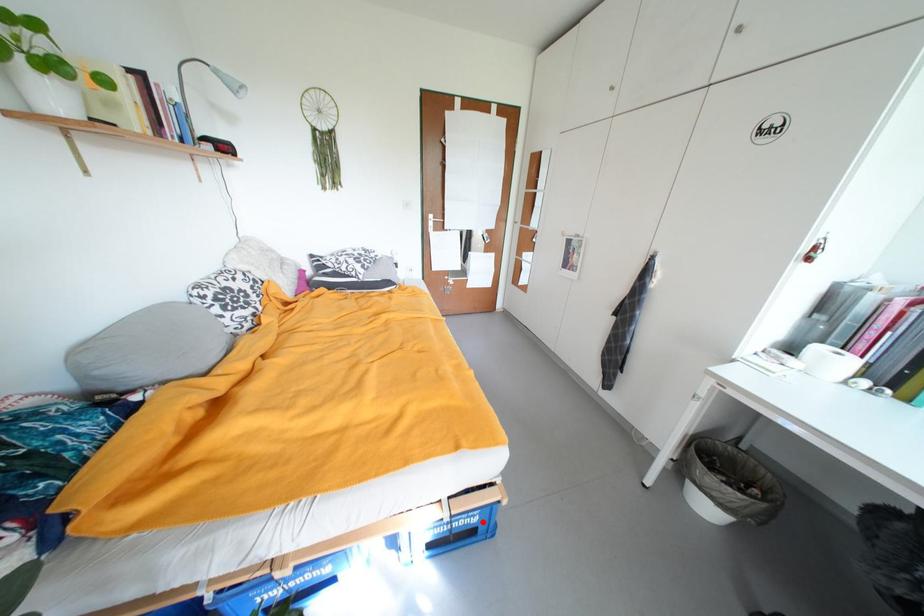
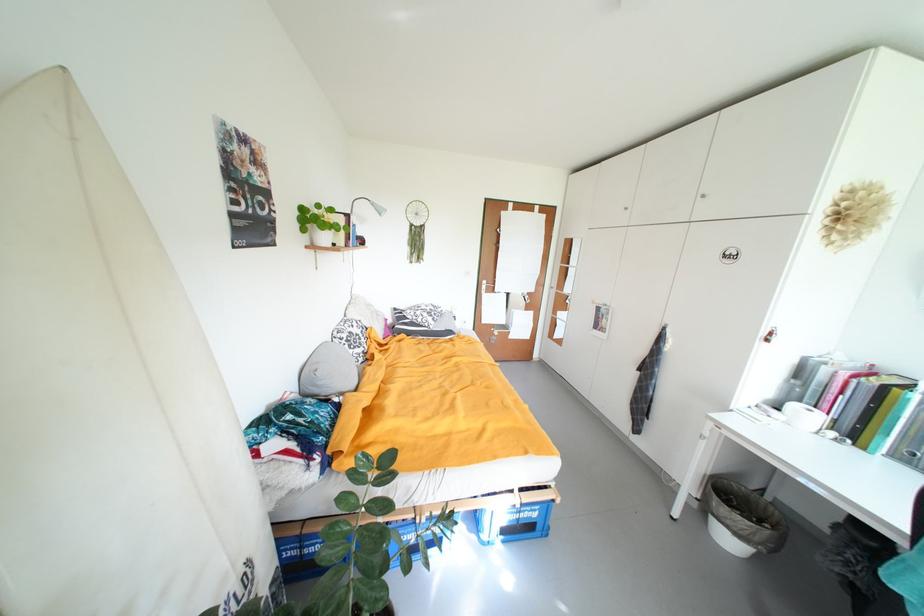
In the second image, find the point that corresponds to the highlighted location in the first image.

(543, 517)